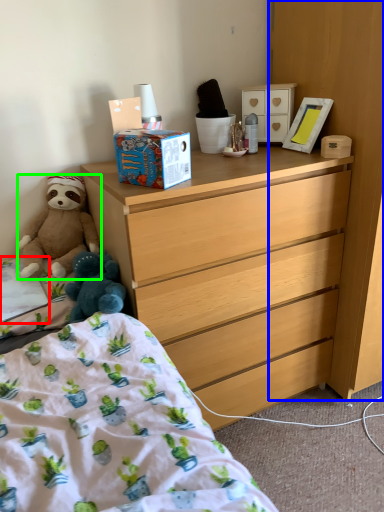
Question: Based on their relative distances, which object is nearer to sheet (highlighted by a red box)? Choose from cabinetry (highlighted by a blue box) and teddy bear (highlighted by a green box).

Choices:
 (A) cabinetry
 (B) teddy bear

Answer: (B)